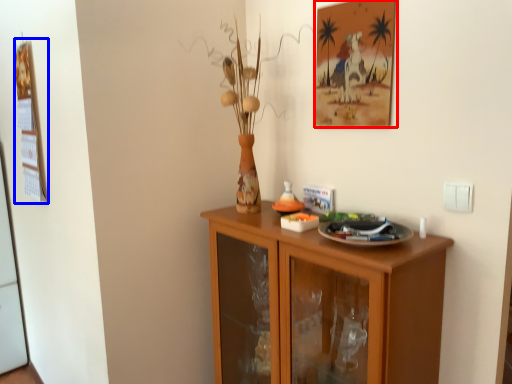
Question: Which point is further to the camera, picture frame (highlighted by a red box) or picture frame (highlighted by a blue box)?

Choices:
 (A) picture frame
 (B) picture frame

Answer: (B)